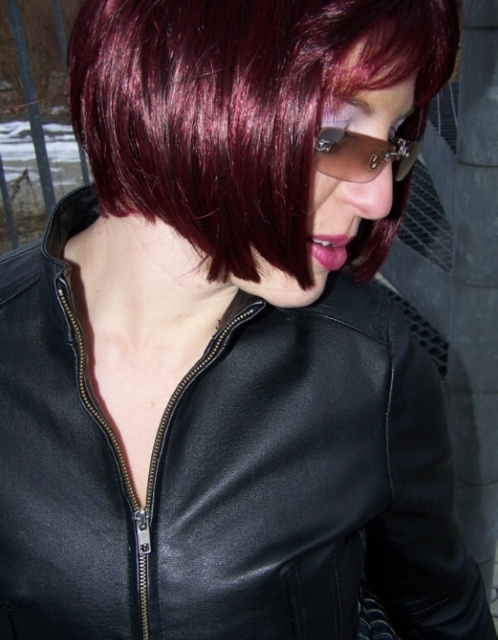
Question: Is shiny burgundy hair at center closer to the viewer compared to sunglasses at center?

Choices:
 (A) no
 (B) yes

Answer: (B)

Question: Can you confirm if shiny burgundy hair at center is positioned below sunglasses at center?

Choices:
 (A) yes
 (B) no

Answer: (B)

Question: Can you confirm if shiny burgundy hair at center is bigger than sunglasses at center?

Choices:
 (A) yes
 (B) no

Answer: (A)

Question: Which point is farther to the camera?

Choices:
 (A) shiny burgundy hair at center
 (B) sunglasses at center

Answer: (B)

Question: Which object is farther from the camera taking this photo?

Choices:
 (A) sunglasses at center
 (B) shiny burgundy hair at center

Answer: (A)